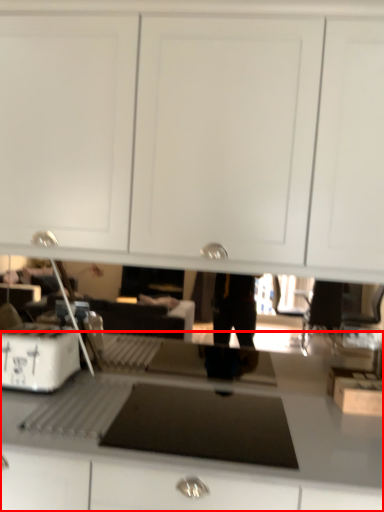
Question: From the image's perspective, considering the relative positions of countertop (annotated by the red box) and home appliance in the image provided, where is countertop (annotated by the red box) located with respect to the staircase?

Choices:
 (A) above
 (B) below

Answer: (B)